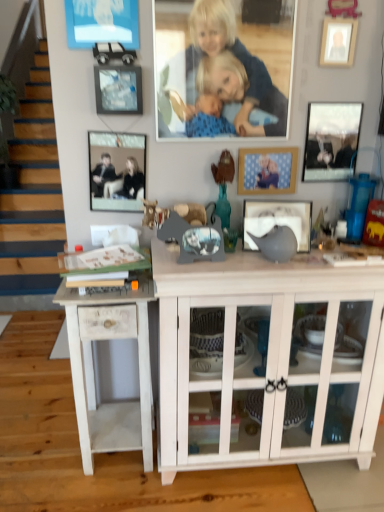
I want to click on vacant area in front of matte black picture frame at center, which appears as the 3th picture frame when viewed from the right, so click(288, 265).